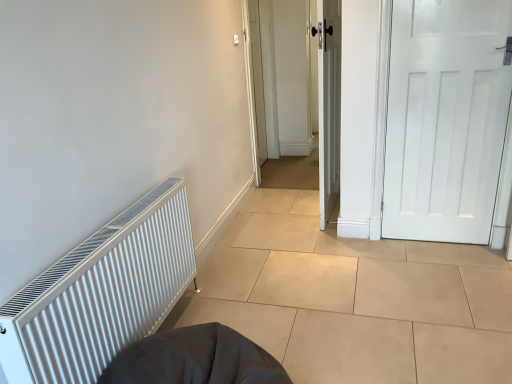
Describe the element at coordinates (356, 299) in the screenshot. I see `white matte radiator at left` at that location.

Image resolution: width=512 pixels, height=384 pixels. I want to click on white matte door at right, which appears as the 2th door when viewed from the left, so click(445, 118).

What do you see at coordinates (445, 118) in the screenshot? I see `white matte door at right, which appears as the 2th door when viewed from the left` at bounding box center [445, 118].

Measure the distance between point (336, 163) and camera.

Point (336, 163) and camera are 2.92 meters apart from each other.

This screenshot has width=512, height=384. I want to click on white wooden door at center, the first door from the left, so click(x=329, y=104).

This screenshot has height=384, width=512. What do you see at coordinates (195, 359) in the screenshot? I see `dark gray fabric sleeping bag at lower center` at bounding box center [195, 359].

This screenshot has height=384, width=512. In order to click on white matte radiator at left in this screenshot , I will do `click(356, 299)`.

From a real-world perspective, does white wooden door at center, the first door from the left, sit lower than white matte radiator at left?

Actually, white wooden door at center, the first door from the left, is physically above white matte radiator at left in the real world.

Between white wooden door at center, the first door from the left, and white matte radiator at left, which one has more height?

white wooden door at center, the first door from the left, is taller.

Considering the points (336, 9) and (336, 318), which point is behind, point (336, 9) or point (336, 318)?

Positioned behind is point (336, 9).

Looking at this image, from their relative heights in the image, would you say white matte door at right, which appears as the 2th door when viewed from the left, is taller or shorter than white wooden door at center, the first door from the left?

Considering their sizes, white matte door at right, which appears as the 2th door when viewed from the left, has less height than white wooden door at center, the first door from the left.

Identify the location of door to the left of white matte door at right, which appears as the 2th door when viewed from the left. [329, 104].

Does white matte door at right, which appears as the 2th door when viewed from the left, turn towards white wooden door at center, marked as the second door in a right-to-left arrangement?

No, white matte door at right, which appears as the 2th door when viewed from the left, is not facing towards white wooden door at center, marked as the second door in a right-to-left arrangement.

Is point (362, 351) positioned in front of point (248, 345)?

No, it is behind (248, 345).

Considering the sizes of objects white matte radiator at left and dark gray fabric sleeping bag at lower center in the image provided, who is thinner, white matte radiator at left or dark gray fabric sleeping bag at lower center?

With smaller width is dark gray fabric sleeping bag at lower center.

In the scene shown: From the image's perspective, is white matte radiator at left on top of dark gray fabric sleeping bag at lower center?

Indeed, from the image's perspective, white matte radiator at left is shown above dark gray fabric sleeping bag at lower center.

Would you say white matte radiator at left contains dark gray fabric sleeping bag at lower center?

No.

From a real-world perspective, is white wooden door at center, the first door from the left, on top of white matte door at right, arranged as the 1th door when viewed from the right?

Correct, in the physical world, white wooden door at center, the first door from the left, is higher than white matte door at right, arranged as the 1th door when viewed from the right.

What's the angular difference between white wooden door at center, the first door from the left, and white matte door at right, which appears as the 2th door when viewed from the left,'s facing directions?

There is a 94.3-degree angle between the facing directions of white wooden door at center, the first door from the left, and white matte door at right, which appears as the 2th door when viewed from the left.

Is white wooden door at center, marked as the second door in a right-to-left arrangement, outside of white matte door at right, which appears as the 2th door when viewed from the left?

Yes, white wooden door at center, marked as the second door in a right-to-left arrangement, is not within white matte door at right, which appears as the 2th door when viewed from the left.

In the scene shown: From the image's perspective, which is above, white wooden door at center, marked as the second door in a right-to-left arrangement, or white matte door at right, which appears as the 2th door when viewed from the left?

white wooden door at center, marked as the second door in a right-to-left arrangement, appears higher in the image.

Can you tell me how much white ribbed radiator at left and white matte door at right, arranged as the 1th door when viewed from the right, differ in facing direction?

They differ by 90.2 degrees in their facing directions.

From a real-world perspective, is white ribbed radiator at left below white matte door at right, which appears as the 2th door when viewed from the left?

Indeed, from a real-world perspective, white ribbed radiator at left is positioned beneath white matte door at right, which appears as the 2th door when viewed from the left.

Could you tell me if white ribbed radiator at left is turned towards white matte door at right, arranged as the 1th door when viewed from the right?

No.

Does white ribbed radiator at left have a greater width compared to white matte door at right, which appears as the 2th door when viewed from the left?

Indeed, white ribbed radiator at left has a greater width compared to white matte door at right, which appears as the 2th door when viewed from the left.

Can you confirm if white matte door at right, which appears as the 2th door when viewed from the left, is positioned to the right of dark gray fabric sleeping bag at lower center?

Yes, white matte door at right, which appears as the 2th door when viewed from the left, is to the right of dark gray fabric sleeping bag at lower center.

Is white matte door at right, which appears as the 2th door when viewed from the left, touching dark gray fabric sleeping bag at lower center?

No, white matte door at right, which appears as the 2th door when viewed from the left, is not touching dark gray fabric sleeping bag at lower center.

Is white matte door at right, arranged as the 1th door when viewed from the right, wider than dark gray fabric sleeping bag at lower center?

Incorrect, the width of white matte door at right, arranged as the 1th door when viewed from the right, does not surpass that of dark gray fabric sleeping bag at lower center.

From the image's perspective, is white matte door at right, which appears as the 2th door when viewed from the left, above dark gray fabric sleeping bag at lower center?

Indeed, from the image's perspective, white matte door at right, which appears as the 2th door when viewed from the left, is shown above dark gray fabric sleeping bag at lower center.

Considering the sizes of objects white wooden door at center, the first door from the left, and dark gray fabric sleeping bag at lower center in the image provided, who is taller, white wooden door at center, the first door from the left, or dark gray fabric sleeping bag at lower center?

Standing taller between the two is white wooden door at center, the first door from the left.

From a real-world perspective, relative to dark gray fabric sleeping bag at lower center, is white wooden door at center, the first door from the left, vertically above or below?

In terms of real-world spatial position, white wooden door at center, the first door from the left, is above dark gray fabric sleeping bag at lower center.

What's the angular difference between white wooden door at center, the first door from the left, and dark gray fabric sleeping bag at lower center's facing directions?

The facing directions of white wooden door at center, the first door from the left, and dark gray fabric sleeping bag at lower center are 176 degrees apart.

Considering the sizes of white wooden door at center, marked as the second door in a right-to-left arrangement, and dark gray fabric sleeping bag at lower center in the image, is white wooden door at center, marked as the second door in a right-to-left arrangement, bigger or smaller than dark gray fabric sleeping bag at lower center?

Considering their sizes, white wooden door at center, marked as the second door in a right-to-left arrangement, takes up more space than dark gray fabric sleeping bag at lower center.

What are the coordinates of `tile on the right of white wooden door at center, the first door from the left` in the screenshot? It's located at (356, 299).

You are a GUI agent. You are given a task and a screenshot of the screen. Output one action in this format:
    pyautogui.click(x=<x>, y=<y>)
    Task: Click on the door that is on the left side of white matte door at right, which appears as the 2th door when viewed from the left
    Image resolution: width=512 pixels, height=384 pixels.
    Given the screenshot: What is the action you would take?
    pyautogui.click(x=329, y=104)

Based on their spatial positions, is white matte radiator at left or white matte door at right, arranged as the 1th door when viewed from the right, closer to dark gray fabric sleeping bag at lower center?

white matte radiator at left.

Looking at this image, which object lies nearer to the anchor point white wooden door at center, the first door from the left, white matte radiator at left or white ribbed radiator at left?

Among the two, white matte radiator at left is located nearer to white wooden door at center, the first door from the left.

Based on their spatial positions, is white wooden door at center, the first door from the left, or dark gray fabric sleeping bag at lower center closer to white ribbed radiator at left?

The object closer to white ribbed radiator at left is dark gray fabric sleeping bag at lower center.

Consider the image. Which object lies nearer to the anchor point dark gray fabric sleeping bag at lower center, white matte door at right, which appears as the 2th door when viewed from the left, or white wooden door at center, the first door from the left?

The object closer to dark gray fabric sleeping bag at lower center is white wooden door at center, the first door from the left.

When comparing their distances from white matte door at right, which appears as the 2th door when viewed from the left, does white wooden door at center, marked as the second door in a right-to-left arrangement, or white matte radiator at left seem further?

Among the two, white matte radiator at left is located further to white matte door at right, which appears as the 2th door when viewed from the left.

Considering their positions, is white ribbed radiator at left positioned further to white matte radiator at left than dark gray fabric sleeping bag at lower center?

white ribbed radiator at left.

Which object lies nearer to the anchor point white wooden door at center, the first door from the left, white matte radiator at left or white matte door at right, which appears as the 2th door when viewed from the left?

white matte door at right, which appears as the 2th door when viewed from the left, lies closer to white wooden door at center, the first door from the left, than the other object.

Looking at the image, which one is located further to white matte radiator at left, white wooden door at center, the first door from the left, or white matte door at right, which appears as the 2th door when viewed from the left?

white wooden door at center, the first door from the left, is positioned further to the anchor white matte radiator at left.

Where is `door between white wooden door at center, marked as the second door in a right-to-left arrangement, and dark gray fabric sleeping bag at lower center in the up-down direction`? The image size is (512, 384). door between white wooden door at center, marked as the second door in a right-to-left arrangement, and dark gray fabric sleeping bag at lower center in the up-down direction is located at coordinates (445, 118).

Identify the location of sleeping bag situated between white ribbed radiator at left and white matte radiator at left from left to right. (195, 359).

Find the location of a particular element. This screenshot has height=384, width=512. sleeping bag located between white ribbed radiator at left and white matte door at right, which appears as the 2th door when viewed from the left, in the left-right direction is located at coordinates (195, 359).

You are a GUI agent. You are given a task and a screenshot of the screen. Output one action in this format:
    pyautogui.click(x=<x>, y=<y>)
    Task: Click on the sleeping bag located between white ribbed radiator at left and white wooden door at center, marked as the second door in a right-to-left arrangement, in the depth direction
    This screenshot has height=384, width=512.
    Given the screenshot: What is the action you would take?
    pyautogui.click(x=195, y=359)